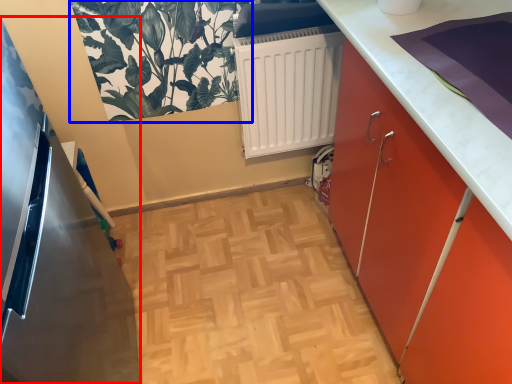
Question: Which of the following is the closest to the observer, appliance (highlighted by a red box) or plant (highlighted by a blue box)?

Choices:
 (A) appliance
 (B) plant

Answer: (A)